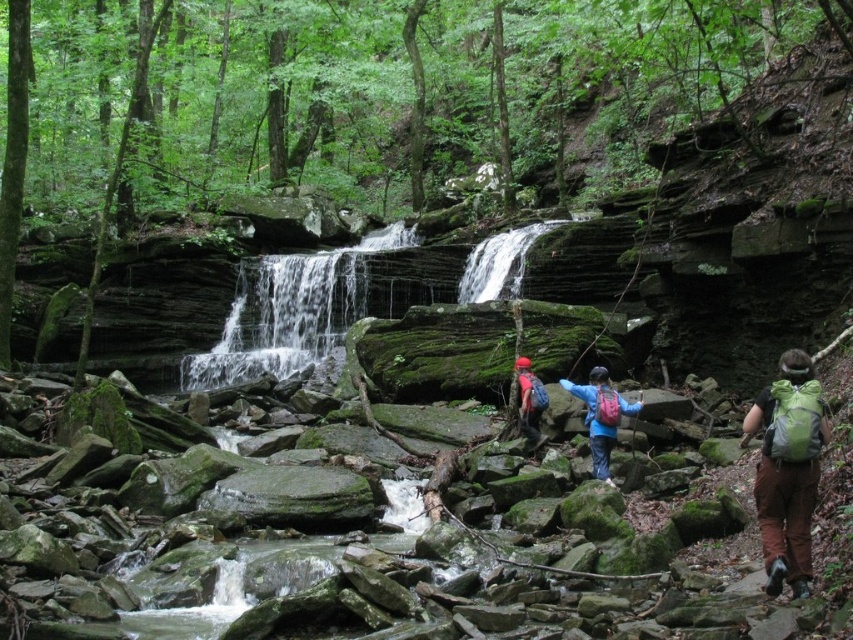
Which is more to the right, white smooth waterfall at center or blue fabric backpack at center?

From the viewer's perspective, blue fabric backpack at center appears more on the right side.

Between white smooth waterfall at center and blue fabric backpack at center, which one is positioned higher?

Positioned higher is white smooth waterfall at center.

Where is `white smooth waterfall at center`? The width and height of the screenshot is (853, 640). white smooth waterfall at center is located at coordinates (502, 262).

Identify the location of white smooth waterfall at center. The height and width of the screenshot is (640, 853). (502, 262).

Looking at this image, does green fabric backpack at right have a lesser width compared to white smooth waterfall at center?

Yes.

Measure the distance between point (815,472) and camera.

26.23 meters

Where is `green fabric backpack at right`? This screenshot has height=640, width=853. green fabric backpack at right is located at coordinates click(x=787, y=468).

Which of these two, green fabric backpack at right or matte red backpack at center, stands taller?

green fabric backpack at right is taller.

Is point (781, 512) more distant than point (520, 410)?

No.

Does point (759, 396) come in front of point (531, 392)?

That is False.

Find the location of a particular element. green fabric backpack at right is located at coordinates (787, 468).